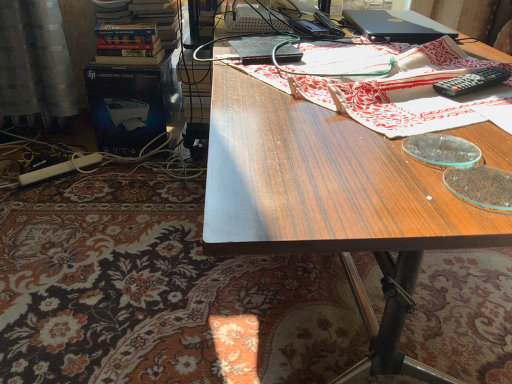
Where is `free space in front of black plastic remote control at upper right`? The width and height of the screenshot is (512, 384). free space in front of black plastic remote control at upper right is located at coordinates [471, 119].